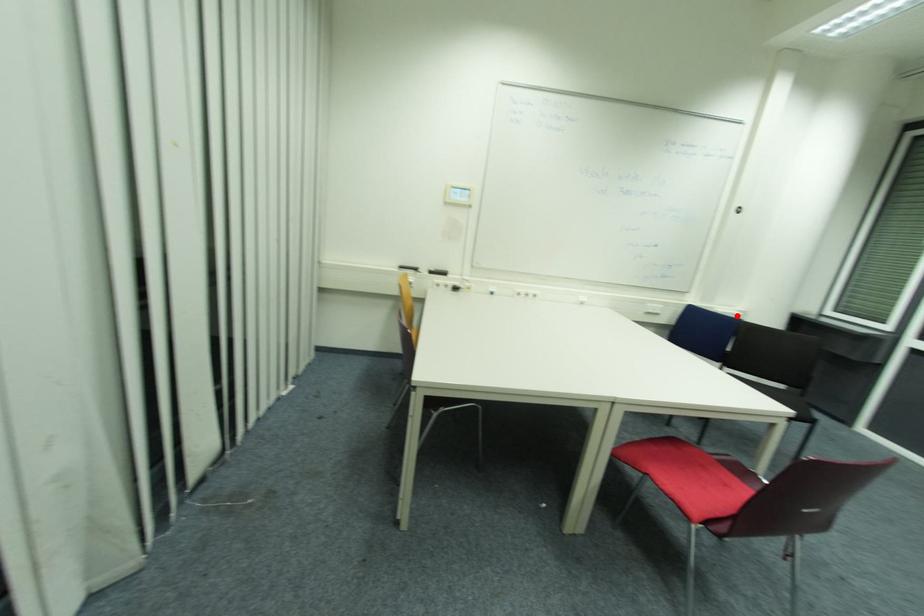
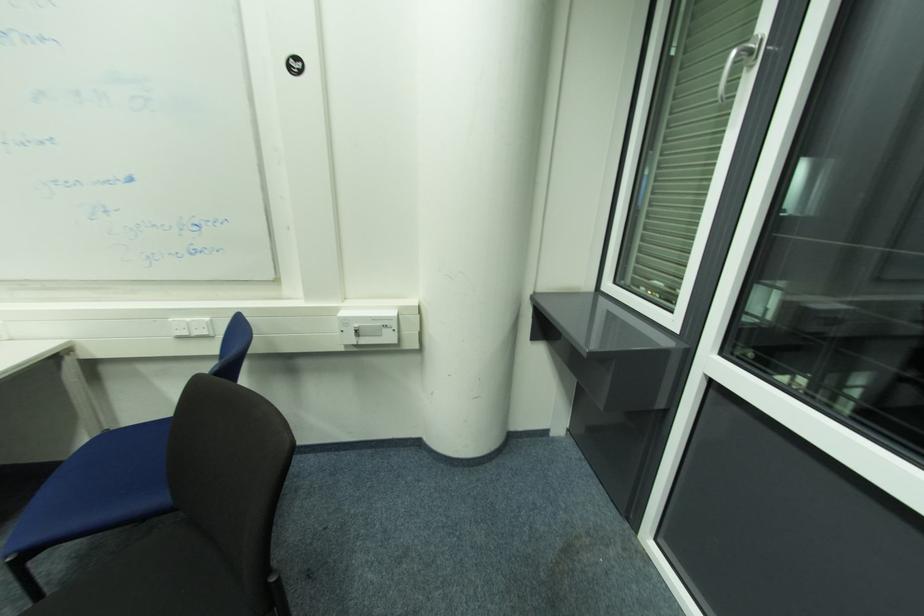
The point at the highlighted location is marked in the first image. Where is the corresponding point in the second image?

(378, 320)